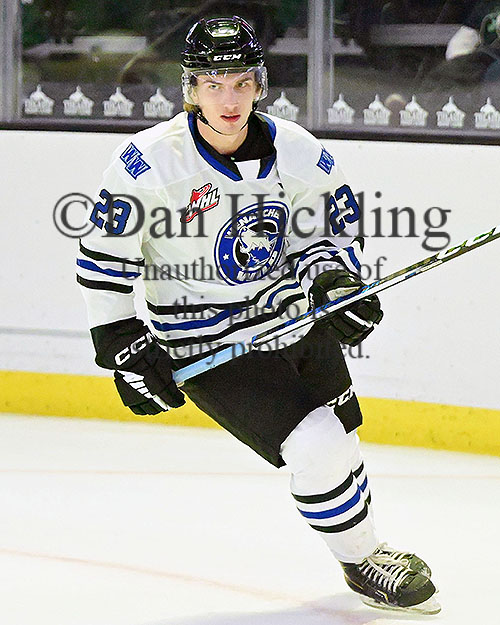
The image size is (500, 625). Find the location of `glass panes`. glass panes is located at coordinates (131, 32), (440, 46).